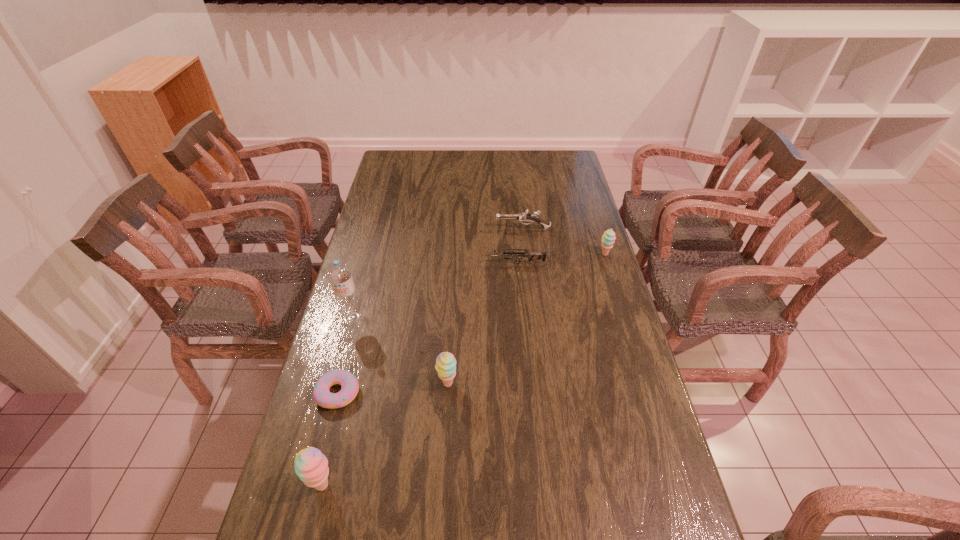
Locate an element on the screen. The image size is (960, 540). the nearest object is located at coordinates (311, 465).

Image resolution: width=960 pixels, height=540 pixels. I want to click on the nearest sherbert, so click(x=311, y=465).

The image size is (960, 540). I want to click on the second tallest sherbert, so click(445, 366).

Find the location of a particular element. the second nearest sherbert is located at coordinates (445, 366).

The image size is (960, 540). Find the location of `the sixth nearest object`. the sixth nearest object is located at coordinates (608, 237).

The height and width of the screenshot is (540, 960). In order to click on the fourth tallest object in this screenshot , I will do `click(608, 237)`.

Where is `the third farthest object`? This screenshot has height=540, width=960. the third farthest object is located at coordinates (531, 256).

Where is `the shorter gun`? the shorter gun is located at coordinates (531, 256).

At what (x,y) coordinates should I click in order to perform the action: click on the third shortest object. Please return your answer as a coordinate pair (x, y). The image size is (960, 540). Looking at the image, I should click on (524, 217).

You are a GUI agent. You are given a task and a screenshot of the screen. Output one action in this format:
    pyautogui.click(x=<x>, y=<y>)
    Task: Click on the taller gun
    This screenshot has height=540, width=960.
    Given the screenshot: What is the action you would take?
    pyautogui.click(x=524, y=217)